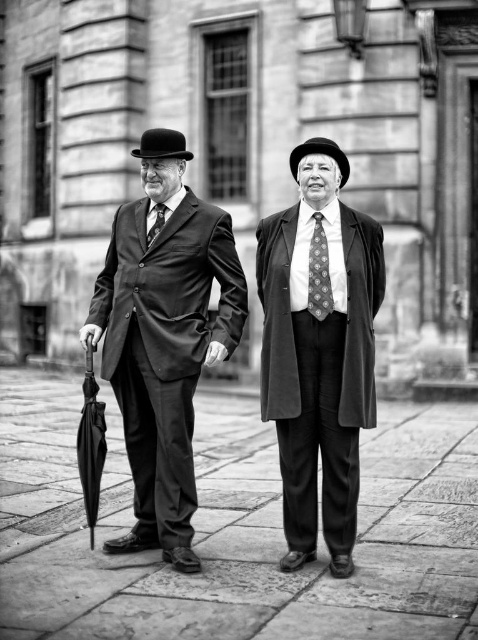
Question: Is slate stone pavement at center to the left of matte black tie at center from the viewer's perspective?

Choices:
 (A) yes
 (B) no

Answer: (B)

Question: Which point appears closest to the camera in this image?

Choices:
 (A) (206, 339)
 (B) (401, 636)

Answer: (B)

Question: Does smooth wool coat at center have a greater width compared to black felt bowler hat at center?

Choices:
 (A) yes
 (B) no

Answer: (A)

Question: Which point is closer to the camera taking this photo?

Choices:
 (A) (12, 524)
 (B) (169, 150)
 (C) (300, 152)
 (D) (327, 497)

Answer: (D)

Question: Does smooth black suit at center have a greater width compared to black felt bowler hat at center?

Choices:
 (A) no
 (B) yes

Answer: (B)

Question: Which of the following is the closest to the observer?

Choices:
 (A) (217, 257)
 (B) (301, 157)

Answer: (B)